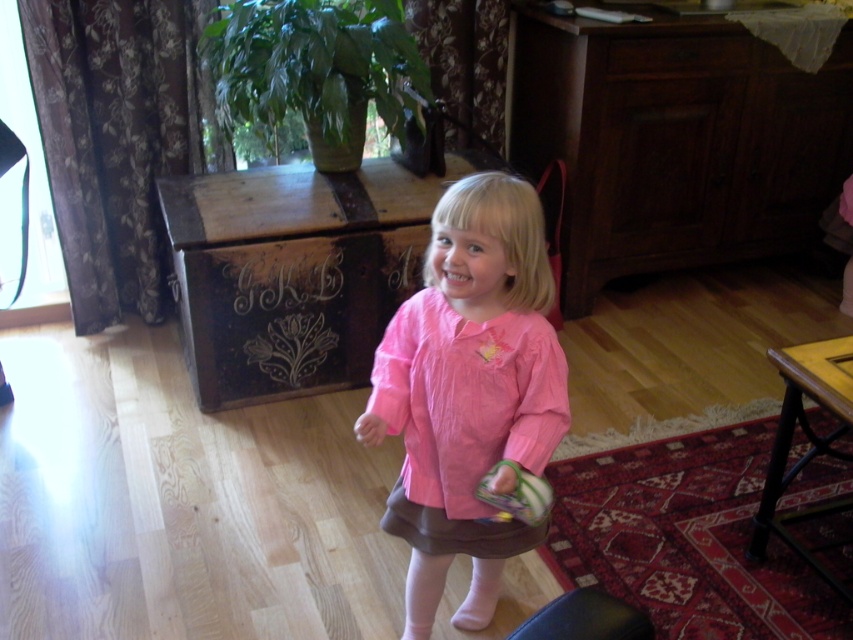
Who is taller, pink satin dress at center or plush green toy at lower center?

With more height is pink satin dress at center.

Can you confirm if pink satin dress at center is shorter than plush green toy at lower center?

No, pink satin dress at center is not shorter than plush green toy at lower center.

Does point (521, 252) come closer to viewer compared to point (491, 496)?

No, it is not.

Where is `pink satin dress at center`? pink satin dress at center is located at coordinates (469, 392).